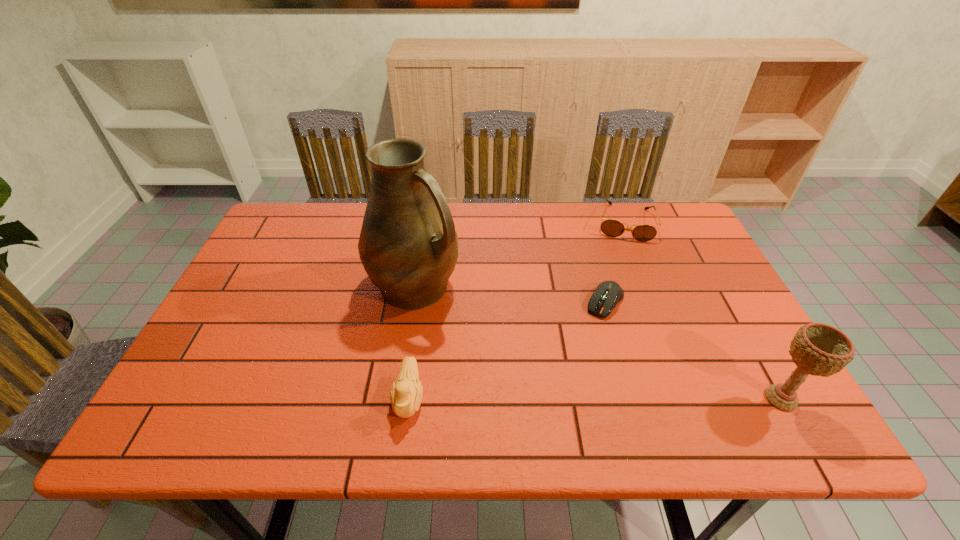
I want to click on chalice present at the right edge, so click(819, 349).

Identify the location of sunglasses situated at the right edge. (612, 228).

The width and height of the screenshot is (960, 540). In order to click on object that is positioned at the far right corner in this screenshot , I will do `click(612, 228)`.

The width and height of the screenshot is (960, 540). I want to click on object at the near right corner, so click(819, 349).

Find the location of a particular element. vacant space at the far edge of the desktop is located at coordinates (496, 247).

This screenshot has width=960, height=540. I want to click on blank space at the near edge, so click(x=601, y=381).

Find the location of `vacant space at the left edge`. vacant space at the left edge is located at coordinates (260, 286).

Find the location of a particular element. The width and height of the screenshot is (960, 540). vacant space at the right edge of the desktop is located at coordinates (729, 314).

At what (x,y) coordinates should I click in order to perform the action: click on free space at the near left corner of the desktop. Please return your answer as a coordinate pair (x, y). Image resolution: width=960 pixels, height=540 pixels. Looking at the image, I should click on (198, 368).

The image size is (960, 540). In the image, there is a desktop. Identify the location of free space at the far right corner. (675, 207).